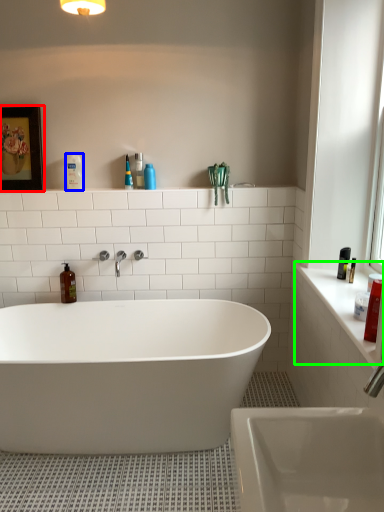
Question: Which is farther away from picture frame (highlighted by a red box)? toiletry (highlighted by a blue box) or counter top (highlighted by a green box)?

Choices:
 (A) toiletry
 (B) counter top

Answer: (B)